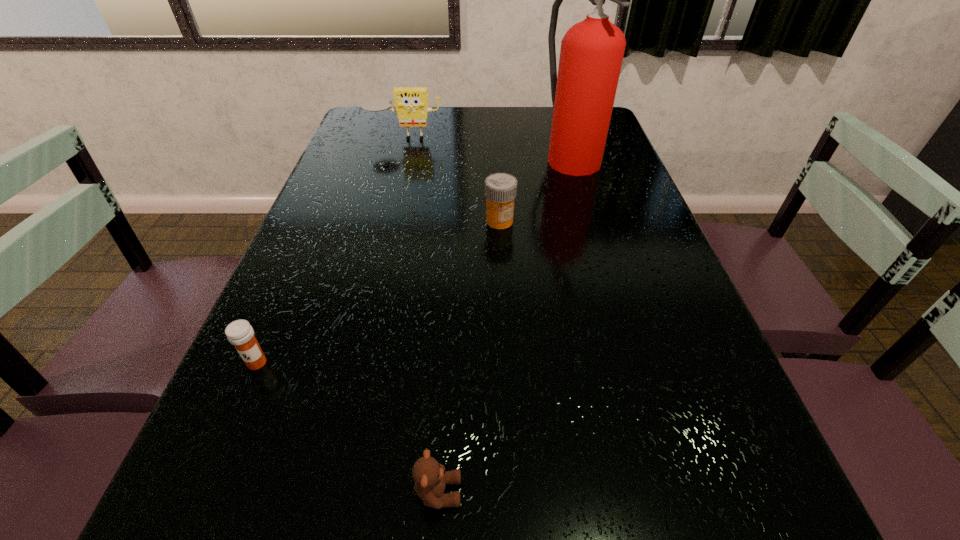
Where is `free space located 0.070m on the handle side of the tallest object`? The width and height of the screenshot is (960, 540). free space located 0.070m on the handle side of the tallest object is located at coordinates (582, 194).

Image resolution: width=960 pixels, height=540 pixels. Identify the location of vacant area situated 0.150m on the front-facing side of the fourth object from right to left. (396, 168).

You are a GUI agent. You are given a task and a screenshot of the screen. Output one action in this format:
    pyautogui.click(x=<x>, y=<y>)
    Task: Click on the vacant space situated 0.340m on the label side of the third nearest object
    
    Given the screenshot: What is the action you would take?
    pyautogui.click(x=506, y=342)

Locate an element on the screen. The height and width of the screenshot is (540, 960). vacant space situated on the label side of the shorter medicine is located at coordinates (219, 449).

This screenshot has height=540, width=960. What are the coordinates of `vacant position located on the face of the third object from left to right` in the screenshot? It's located at (503, 492).

I want to click on fire extinguisher positioned at the far edge, so click(x=583, y=93).

The width and height of the screenshot is (960, 540). Find the location of `sponge at the far edge`. sponge at the far edge is located at coordinates (411, 104).

Find the location of `sponge that is at the left edge`. sponge that is at the left edge is located at coordinates (411, 104).

Where is `medicine located at the left edge`? medicine located at the left edge is located at coordinates (240, 333).

Find the location of a particular element. This screenshot has width=960, height=540. object present at the right edge is located at coordinates (583, 93).